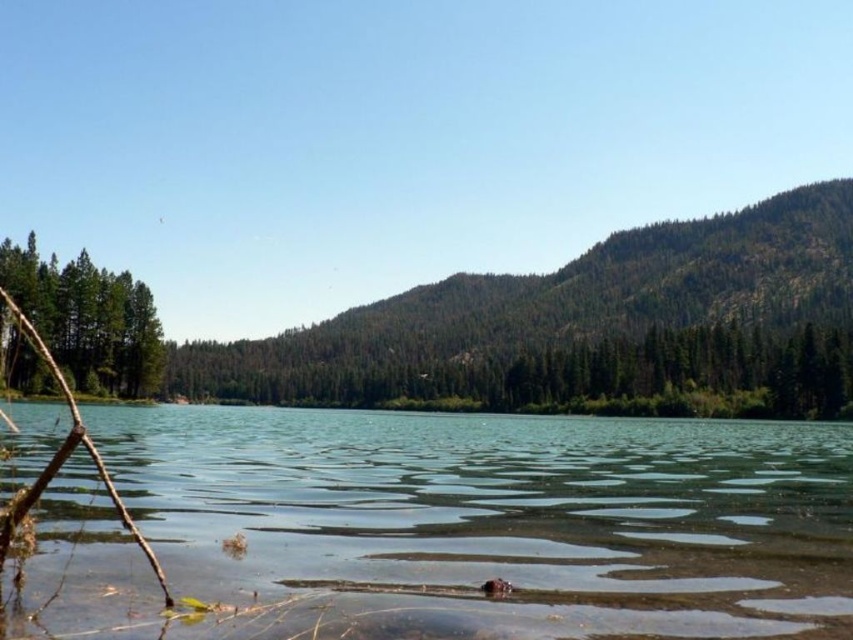
Question: Can you confirm if green forested mountain at center is positioned below green matte tree at left?

Choices:
 (A) yes
 (B) no

Answer: (B)

Question: Can you confirm if green forested mountain at center is positioned below green matte tree at left?

Choices:
 (A) yes
 (B) no

Answer: (B)

Question: Which of these objects is positioned farthest from the brown wood twig at left?

Choices:
 (A) green matte tree at left
 (B) green forested mountain at center
 (C) clear water at center

Answer: (B)

Question: Can you confirm if green matte tree at left is bigger than brown wood twig at left?

Choices:
 (A) yes
 (B) no

Answer: (B)

Question: Which of these objects is positioned farthest from the brown wood twig at left?

Choices:
 (A) clear water at center
 (B) green matte tree at left

Answer: (A)

Question: Among these objects, which one is nearest to the camera?

Choices:
 (A) clear water at center
 (B) green forested mountain at center
 (C) green matte tree at left
 (D) brown wood twig at left

Answer: (A)